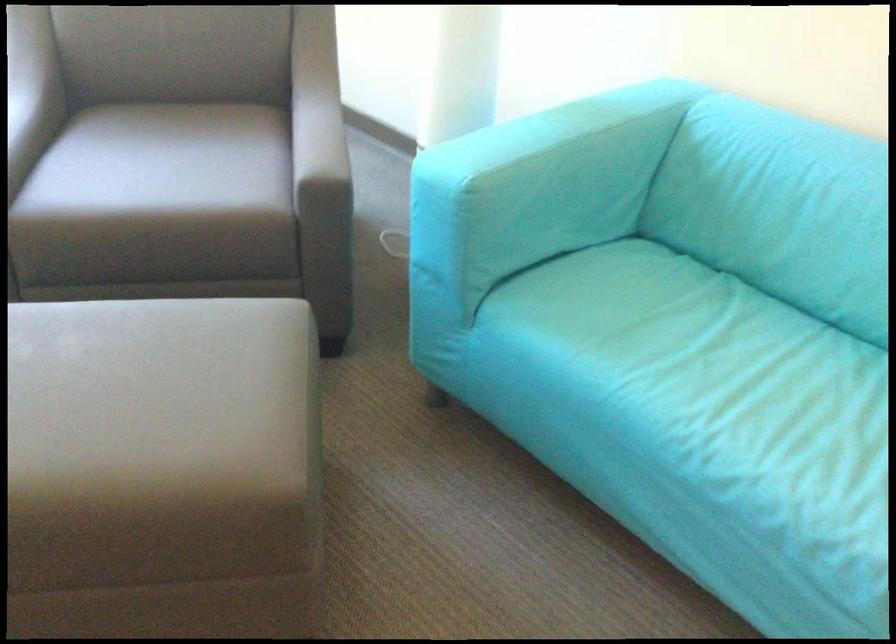
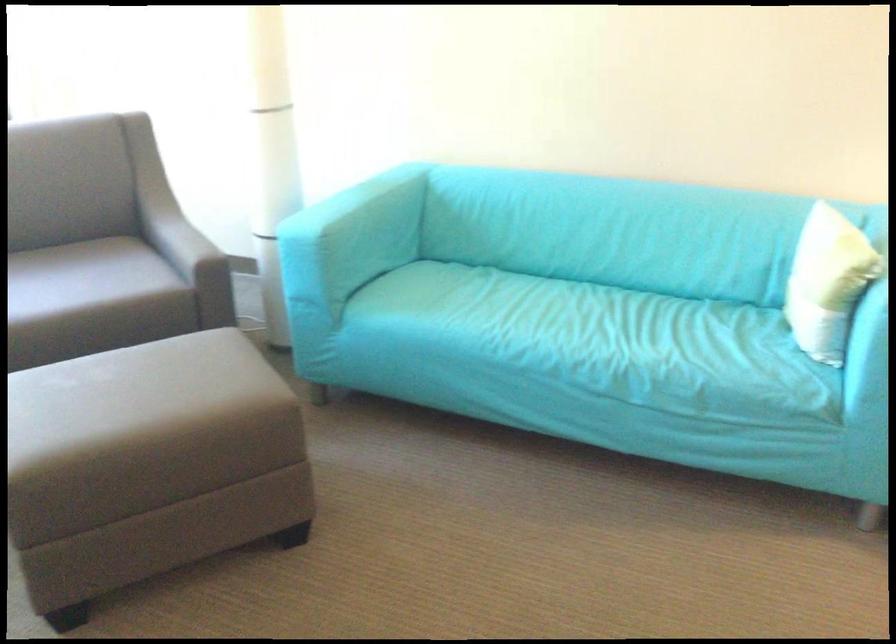
Find the pixel in the second image that matches the point at 76,536 in the first image.

(149, 464)